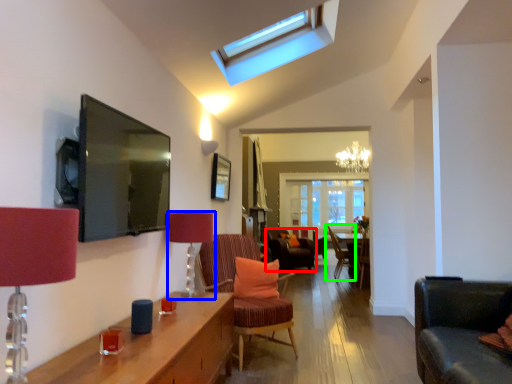
Question: Estimate the real-world distances between objects in this image. Which object is closer to chair (highlighted by a red box), table lamp (highlighted by a blue box) or chair (highlighted by a green box)?

Choices:
 (A) table lamp
 (B) chair

Answer: (B)